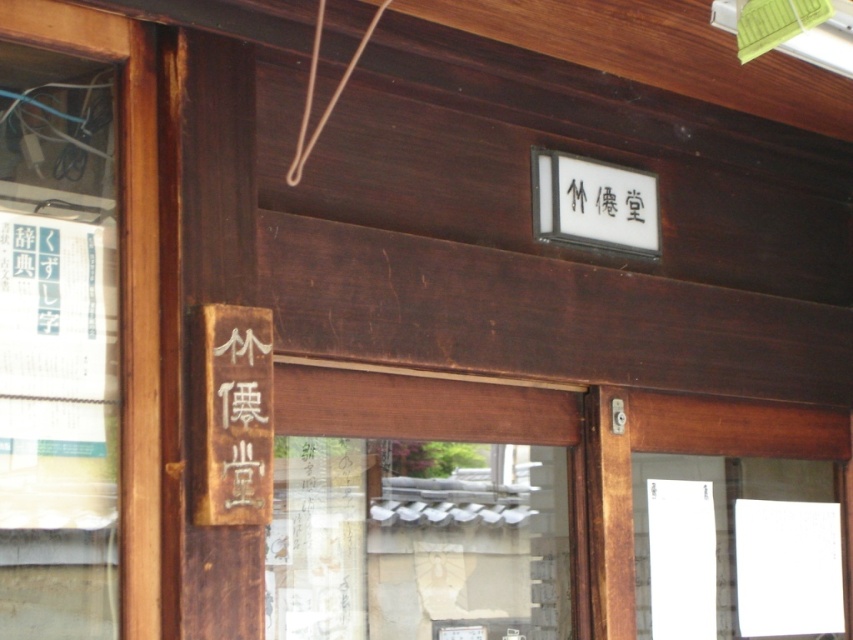
Measure the distance between wooden door at center and wooden sign at left.

A distance of 4.10 feet exists between wooden door at center and wooden sign at left.

From the picture: Who is more distant from viewer, (682, 404) or (241, 352)?

The point (682, 404) is behind.

Locate an element on the screen. Image resolution: width=853 pixels, height=640 pixels. wooden door at center is located at coordinates (677, 452).

Is wooden door at center bigger than black wood sign at upper center?

Indeed, wooden door at center has a larger size compared to black wood sign at upper center.

Describe the element at coordinates (677, 452) in the screenshot. This screenshot has height=640, width=853. I see `wooden door at center` at that location.

Find the location of `wooden door at center`. wooden door at center is located at coordinates (677, 452).

Which of these two, wooden sign at left or black wood sign at upper center, stands taller?

Standing taller between the two is wooden sign at left.

What do you see at coordinates (241, 420) in the screenshot? This screenshot has width=853, height=640. I see `wooden sign at left` at bounding box center [241, 420].

Locate an element on the screen. The image size is (853, 640). wooden sign at left is located at coordinates (241, 420).